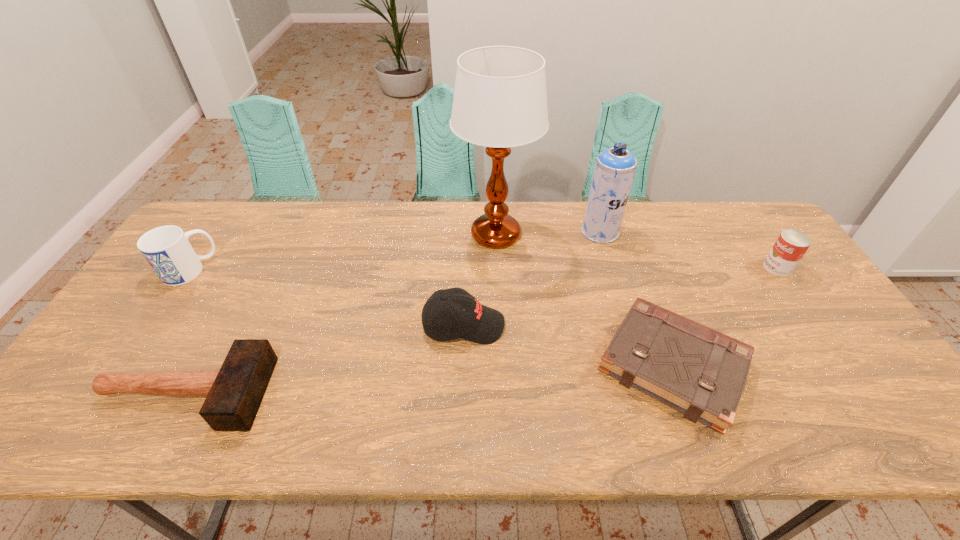
Locate an element on the screen. Image resolution: width=960 pixels, height=540 pixels. the tallest object is located at coordinates (500, 101).

Where is `aerosol can`? aerosol can is located at coordinates (614, 170).

Identify the location of mug. 167,249.

Locate an element on the screen. can is located at coordinates (791, 245).

What are the coordinates of `baseball cap` in the screenshot? It's located at pyautogui.click(x=477, y=323).

At what (x,y) coordinates should I click in order to perform the action: click on mallet. Please return your answer as a coordinate pair (x, y). The height and width of the screenshot is (540, 960). Looking at the image, I should click on (234, 393).

This screenshot has width=960, height=540. Identify the location of hardback book. 694,369.

This screenshot has height=540, width=960. Find the location of `free point located 0.150m on the right of the tallest object`. free point located 0.150m on the right of the tallest object is located at coordinates (582, 235).

Identify the location of free location located 0.330m on the left of the sixth shortest object. (481, 232).

Locate an element on the screen. vacant space located 0.210m on the back of the mug is located at coordinates coord(227,214).